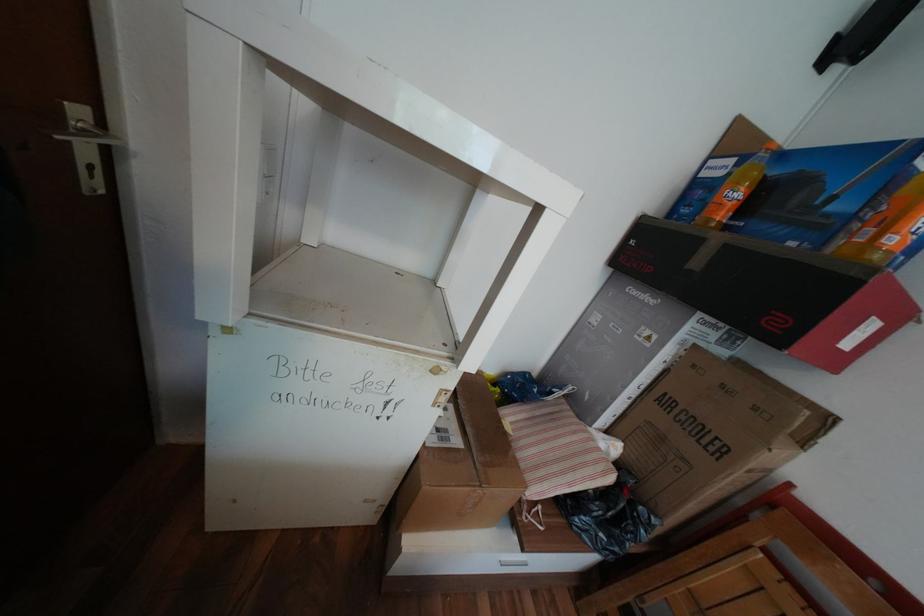
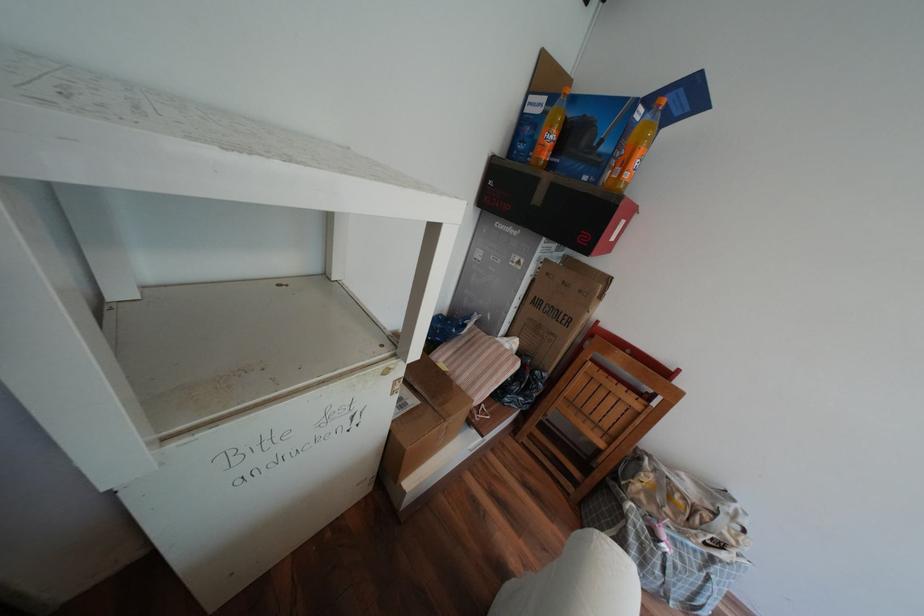
Locate, in the second image, the point that corresponds to point (710, 241) in the first image.

(545, 180)